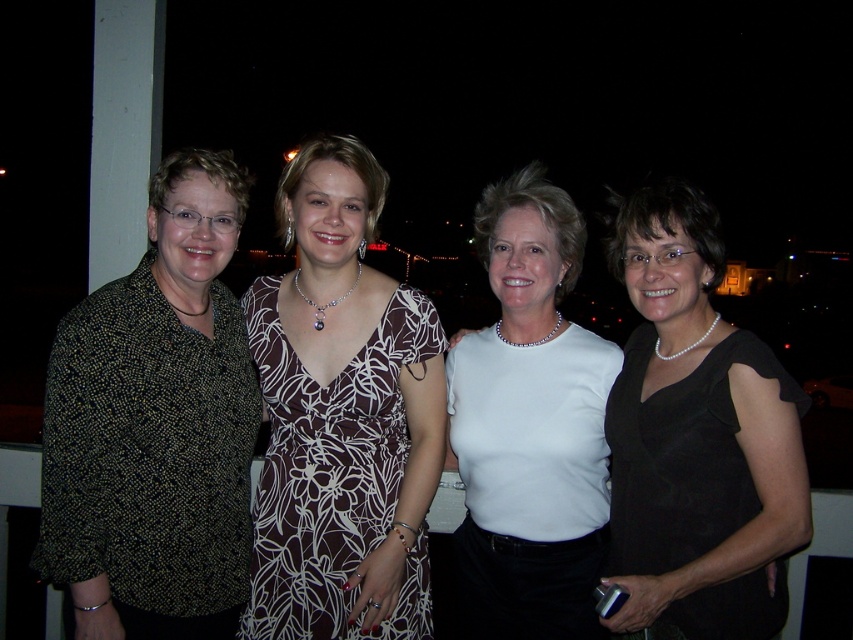
Question: Which point is farther from the camera taking this photo?

Choices:
 (A) (334, 500)
 (B) (166, 609)

Answer: (A)

Question: Does dark green textured blouse at left appear on the left side of black satin dress at right?

Choices:
 (A) no
 (B) yes

Answer: (B)

Question: Can you confirm if white satin blouse at center is bigger than brown floral dress at center?

Choices:
 (A) no
 (B) yes

Answer: (B)

Question: Among these points, which one is nearest to the camera?

Choices:
 (A) (93, 376)
 (B) (660, 472)
 (C) (532, 589)

Answer: (A)

Question: Can you confirm if dark green textured blouse at left is positioned above brown floral dress at center?

Choices:
 (A) yes
 (B) no

Answer: (A)

Question: Among these points, which one is nearest to the camera?

Choices:
 (A) (601, 520)
 (B) (105, 328)
 (C) (321, 468)

Answer: (B)